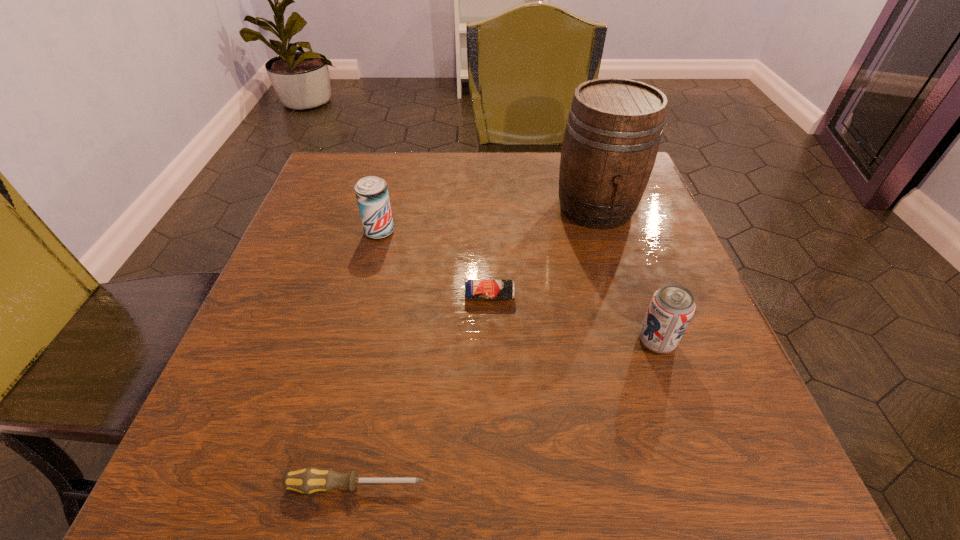
The image size is (960, 540). Find the location of `vacant space that satisfies the following two spatial constraints: 1. on the side of the fourth farthest object near the bung hole; 2. on the right side of the tallest object`. vacant space that satisfies the following two spatial constraints: 1. on the side of the fourth farthest object near the bung hole; 2. on the right side of the tallest object is located at coordinates [637, 341].

At what (x,y) coordinates should I click in order to perform the action: click on free point that satisfies the following two spatial constraints: 1. on the front side of the nearest beer can; 2. on the right side of the farthest beer can. Please return your answer as a coordinate pair (x, y). The image size is (960, 540). Looking at the image, I should click on pos(352,341).

The height and width of the screenshot is (540, 960). Find the location of `free spot that satisfies the following two spatial constraints: 1. on the side of the cider near the bung hole; 2. on the right side of the fourth farthest object`. free spot that satisfies the following two spatial constraints: 1. on the side of the cider near the bung hole; 2. on the right side of the fourth farthest object is located at coordinates (637, 341).

Where is `vacant area in the image that satisfies the following two spatial constraints: 1. on the side of the rightmost beer can near the bung hole; 2. on the left side of the tallest object`? This screenshot has height=540, width=960. vacant area in the image that satisfies the following two spatial constraints: 1. on the side of the rightmost beer can near the bung hole; 2. on the left side of the tallest object is located at coordinates tap(637, 341).

Find the location of `vacant space that satisfies the following two spatial constraints: 1. on the side of the tallest object near the bung hole; 2. on the right side of the fourth farthest object`. vacant space that satisfies the following two spatial constraints: 1. on the side of the tallest object near the bung hole; 2. on the right side of the fourth farthest object is located at coordinates (637, 341).